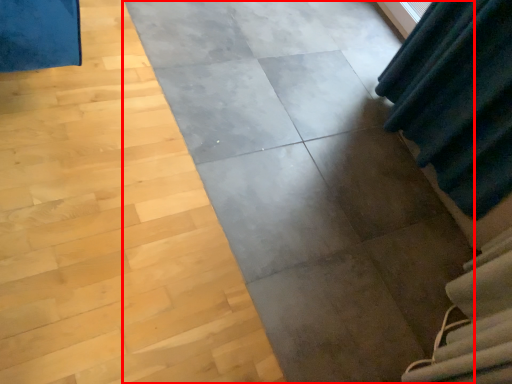
Question: Where is concrete (annotated by the red box) located in relation to stairwell in the image?

Choices:
 (A) right
 (B) left

Answer: (B)